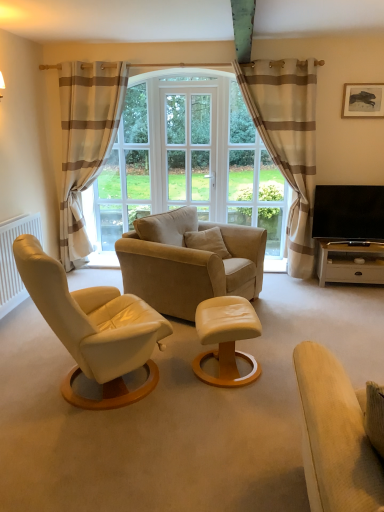
You are a GUI agent. You are given a task and a screenshot of the screen. Output one action in this format:
    pyautogui.click(x=<x>, y=<y>)
    Task: Click on the free location in front of white glossy table at right, which is counted as the first table, starting from the top
    The image size is (384, 512).
    Given the screenshot: What is the action you would take?
    pyautogui.click(x=355, y=301)